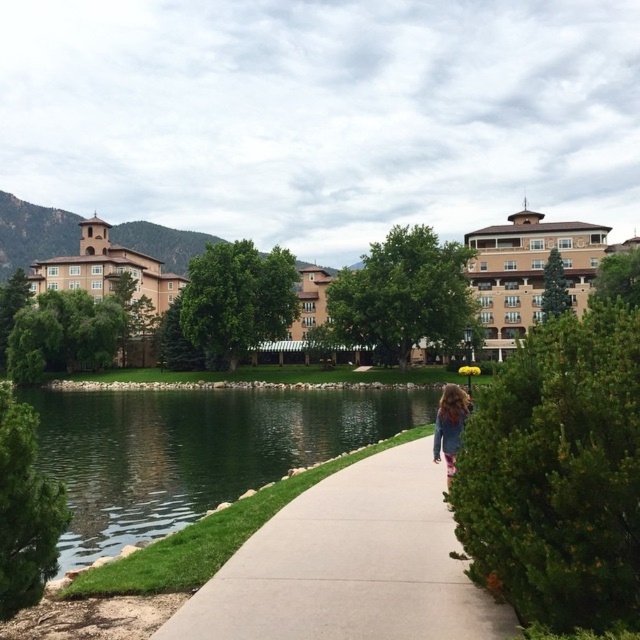
Question: Is green liquid water at lower left smaller than denim jacket at center?

Choices:
 (A) yes
 (B) no

Answer: (B)

Question: Does smooth concrete sidewalk at center come behind green liquid water at lower left?

Choices:
 (A) yes
 (B) no

Answer: (B)

Question: Which point is farther from the camera taking this photo?

Choices:
 (A) (128, 496)
 (B) (310, 582)
 (C) (458, 394)

Answer: (A)

Question: Based on their relative distances, which object is nearer to the denim jacket at center?

Choices:
 (A) green liquid water at lower left
 (B) smooth concrete sidewalk at center

Answer: (B)

Question: Can you confirm if green liquid water at lower left is positioned to the right of denim jacket at center?

Choices:
 (A) no
 (B) yes

Answer: (A)

Question: Considering the real-world distances, which object is farthest from the green liquid water at lower left?

Choices:
 (A) smooth concrete sidewalk at center
 (B) denim jacket at center

Answer: (A)